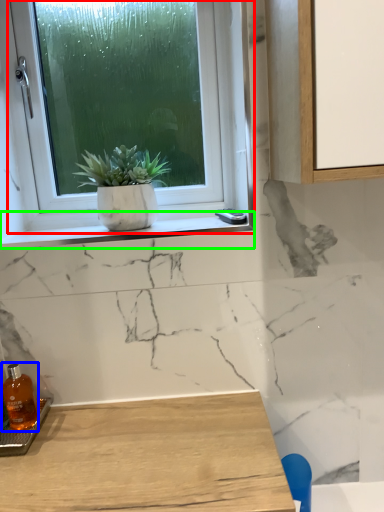
Question: Which object is positioned farthest from window (highlighted by a red box)? Select from bottle (highlighted by a blue box) and window sill (highlighted by a green box).

Choices:
 (A) bottle
 (B) window sill

Answer: (A)